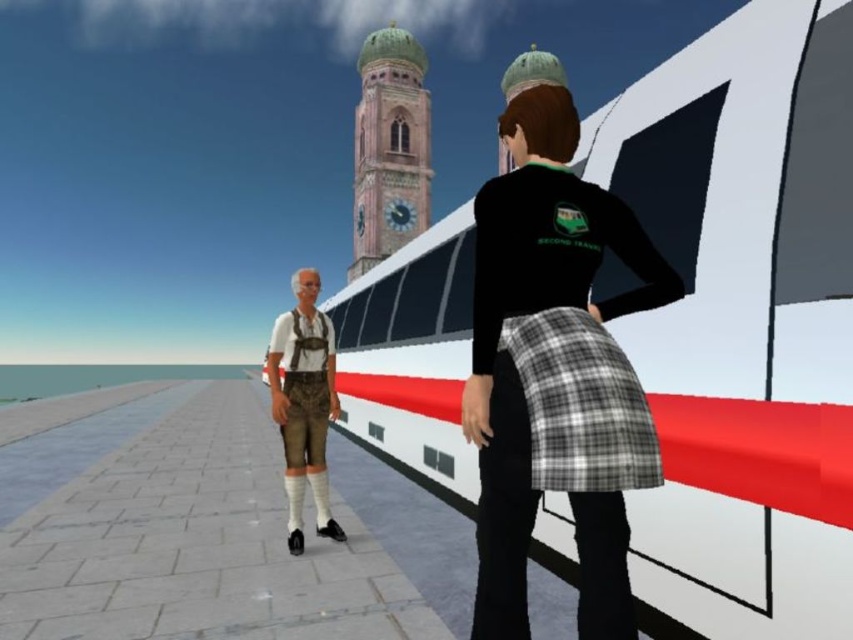
You are a photographer trying to capture both the white glossy train at center and the leather brown leather pants at center in a single shot. Based on their positions, which object should you focus on first to ensure both are in focus?

The white glossy train at center is further to the viewer than the leather brown leather pants at center, so you should focus on the train first to ensure both are in focus.

You are a passenger waiting at the station and want to board the white glossy train at center. Based on the coordinates provided, where exactly should you walk to locate the entrance?

The entrance to the white glossy train at center is located at point (743, 321).